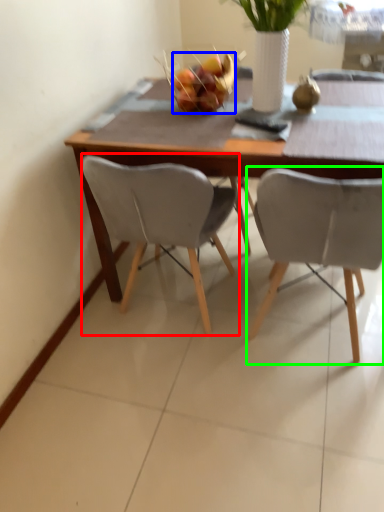
Question: Which is nearer to the chair (highlighted by a red box)? fruit (highlighted by a blue box) or chair (highlighted by a green box).

Choices:
 (A) fruit
 (B) chair

Answer: (B)